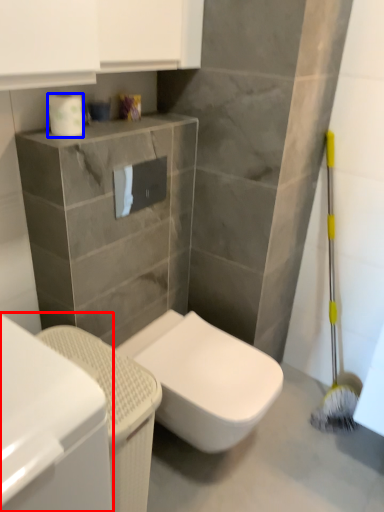
Question: Which object appears farthest to the camera in this image, cabinetry (highlighted by a red box) or toilet paper (highlighted by a blue box)?

Choices:
 (A) cabinetry
 (B) toilet paper

Answer: (B)